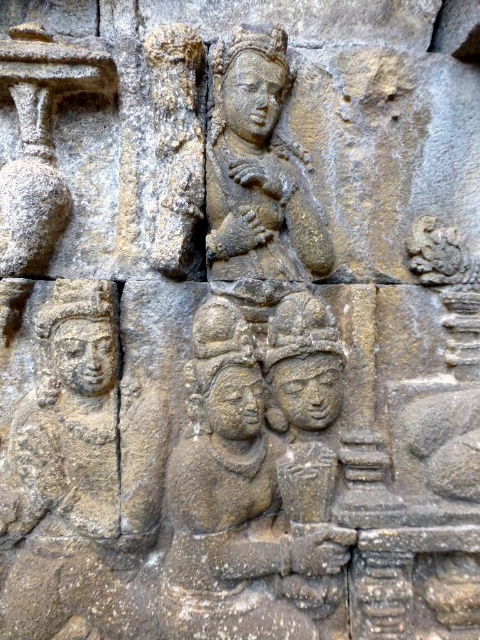
Question: Which of the following is the farthest from the observer?

Choices:
 (A) (297, 198)
 (B) (240, 333)

Answer: (A)

Question: Does gray stone figures at center appear on the right side of gray stone statue at upper center?

Choices:
 (A) yes
 (B) no

Answer: (A)

Question: Can you confirm if gray stone figures at center is thinner than gray stone statue at upper center?

Choices:
 (A) no
 (B) yes

Answer: (A)

Question: Does gray stone figures at center lie in front of gray stone statue at upper center?

Choices:
 (A) yes
 (B) no

Answer: (A)

Question: Which point is closer to the camera taking this photo?

Choices:
 (A) (294, 576)
 (B) (231, 106)

Answer: (A)